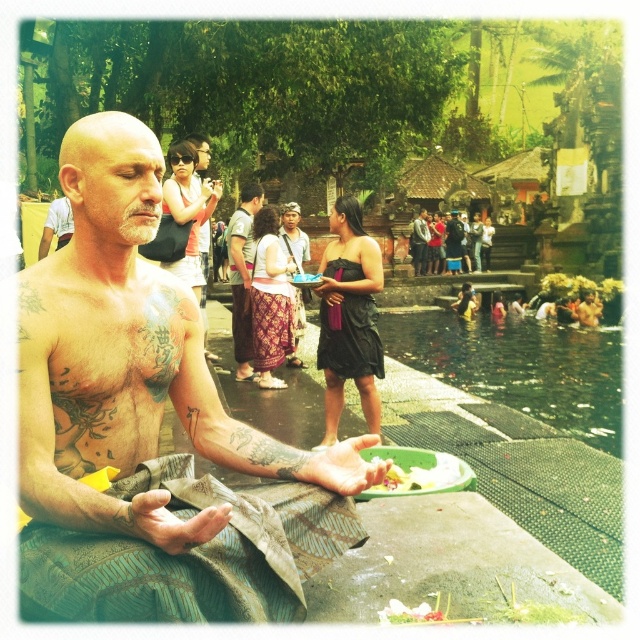
You are a visitor at this temple and want to place a flower offering on the shiny metallic cloth at center. However, there is also a patterned fabric sarong at center. Which object should you place the flower on to ensure it is in front of the other?

You should place the flower on the shiny metallic cloth at center because it is already positioned in front of the patterned fabric sarong at center, so the flower will remain visible in front of the sarong.

You are a visitor at this temple and want to place a small offering on the shiny metallic cloth at center and the patterned fabric sarong at center. Which surface can accommodate a wider item without it hanging off the edge?

The patterned fabric sarong at center can accommodate a wider item because it is wider than the shiny metallic cloth at center.